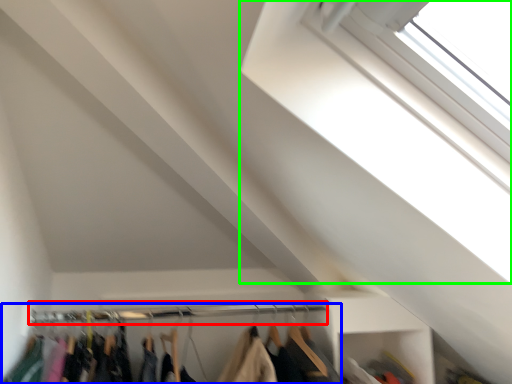
Question: Based on their relative distances, which object is farther from clothesline (highlighted by a red box)? Choose from closet (highlighted by a blue box) and window (highlighted by a green box).

Choices:
 (A) closet
 (B) window

Answer: (B)